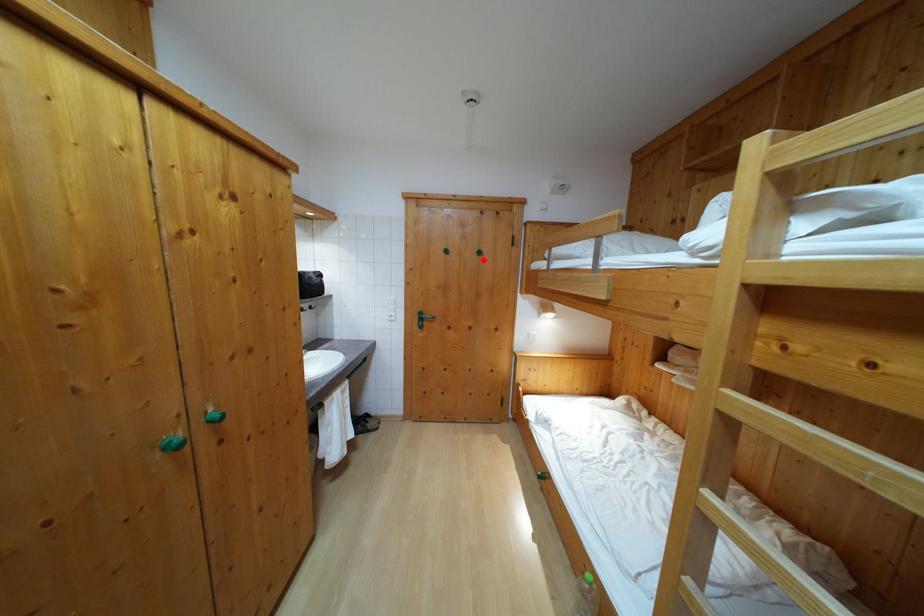
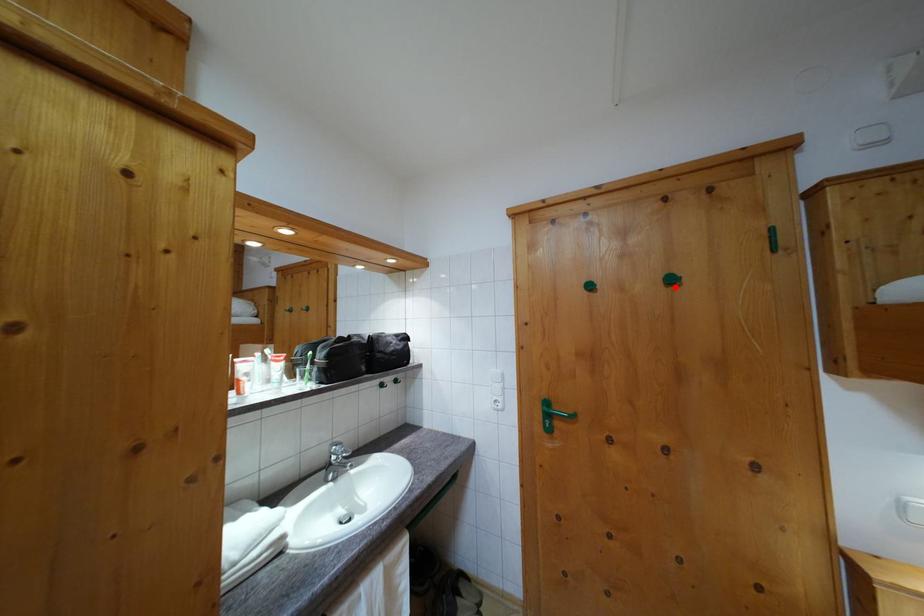
I am providing you with two images of the same scene from different viewpoints. A red point is marked on the first image and another point is marked on the second image. Does the point marked in image1 correspond to the same location as the one in image2?

Yes